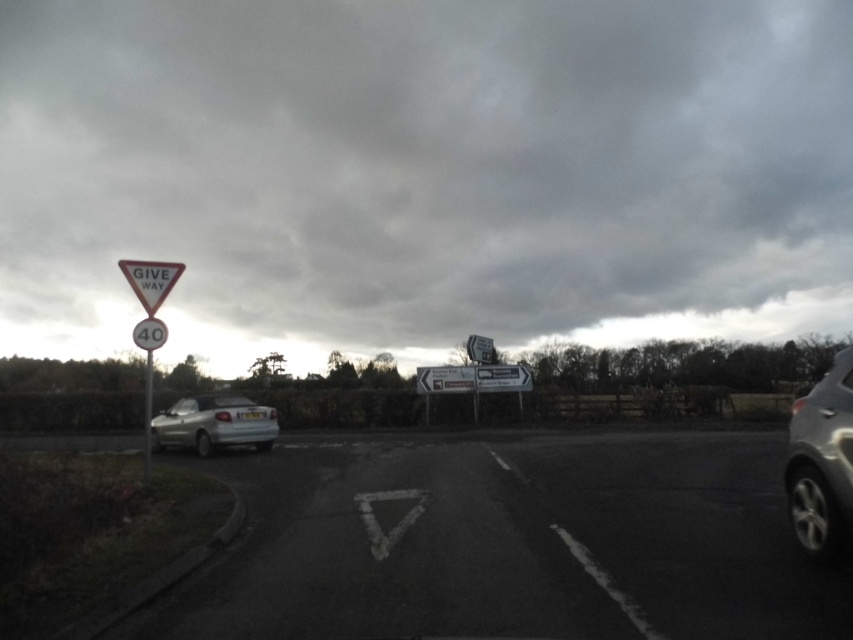
Question: Which of these objects is positioned closest to the white plastic triangle at left?

Choices:
 (A) black asphalt parking lot at center
 (B) white plastic give way sign at left
 (C) gray cloudy sky at upper center

Answer: (B)

Question: Does gray cloudy sky at upper center have a larger size compared to silver metallic car at right?

Choices:
 (A) yes
 (B) no

Answer: (A)

Question: Can you confirm if black asphalt parking lot at center is wider than silver metallic car at right?

Choices:
 (A) yes
 (B) no

Answer: (B)

Question: Which object is positioned farthest from the gray cloudy sky at upper center?

Choices:
 (A) white plastic triangle at left
 (B) silver metallic car at lower left
 (C) white plastic give way sign at left
 (D) silver metallic car at right

Answer: (C)

Question: Does white plastic give way sign at left have a lesser width compared to matte metal speed limit sign at left?

Choices:
 (A) no
 (B) yes

Answer: (A)

Question: Which of these objects is positioned farthest from the silver metallic car at right?

Choices:
 (A) white plastic triangle at left
 (B) matte metal speed limit sign at left
 (C) black asphalt parking lot at center

Answer: (A)